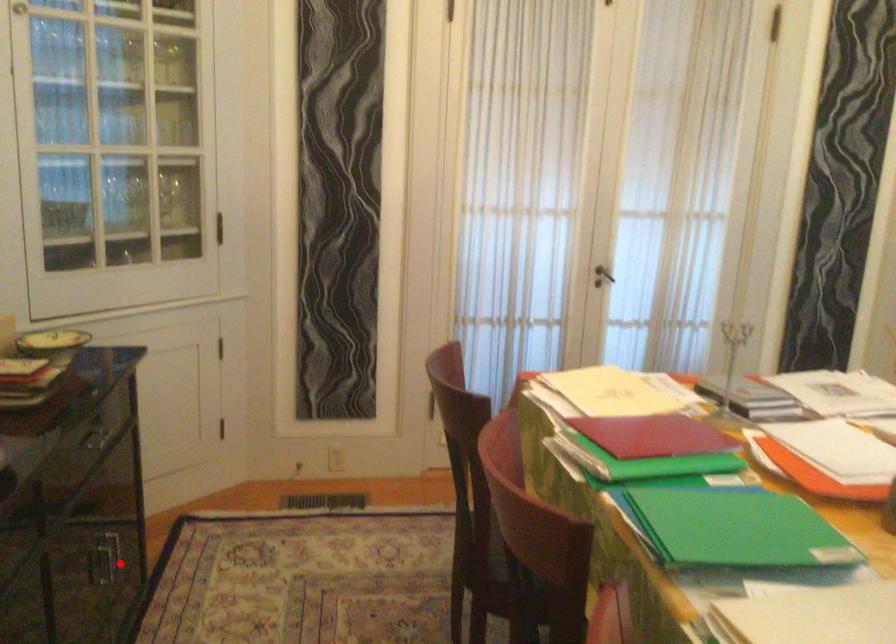
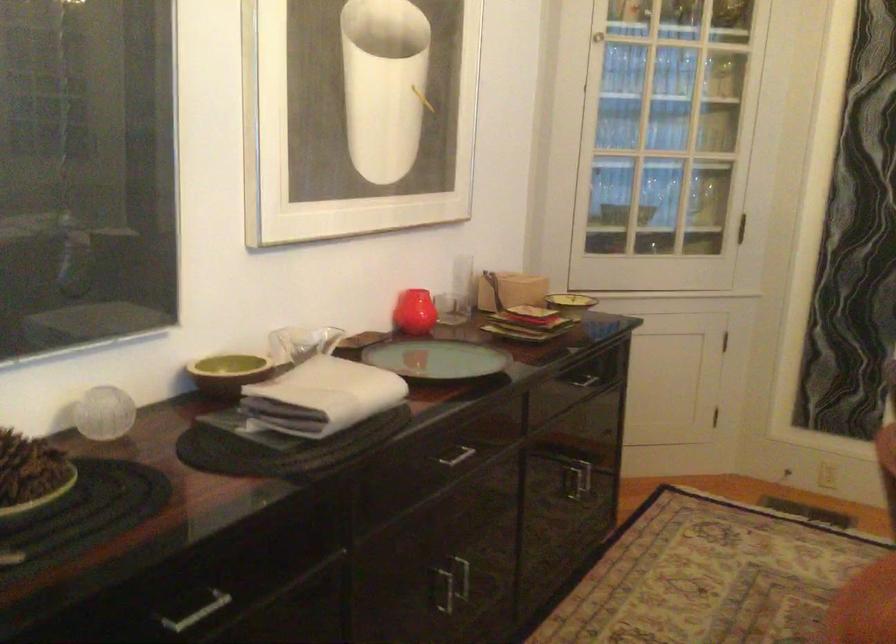
Question: I am providing you with two images of the same scene from different viewpoints. A red point is marked on the first image. Can you still see the location of the red point in image 2?

Choices:
 (A) Yes
 (B) No

Answer: (A)